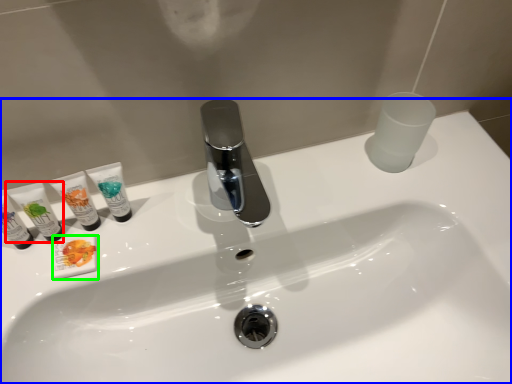
Question: Considering the real-world distances, which object is farthest from toiletry (highlighted by a red box)? sink (highlighted by a blue box) or toiletry (highlighted by a green box)?

Choices:
 (A) sink
 (B) toiletry

Answer: (A)